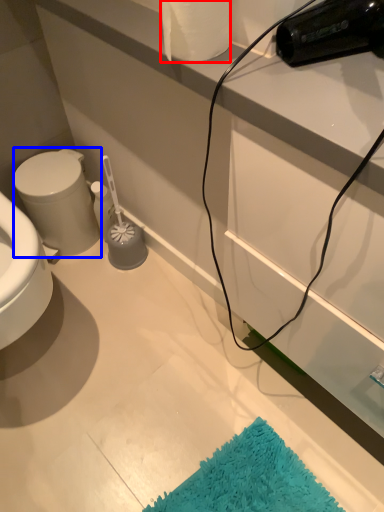
Question: Which object is further to the camera taking this photo, toilet paper (highlighted by a red box) or bidet (highlighted by a blue box)?

Choices:
 (A) toilet paper
 (B) bidet

Answer: (B)